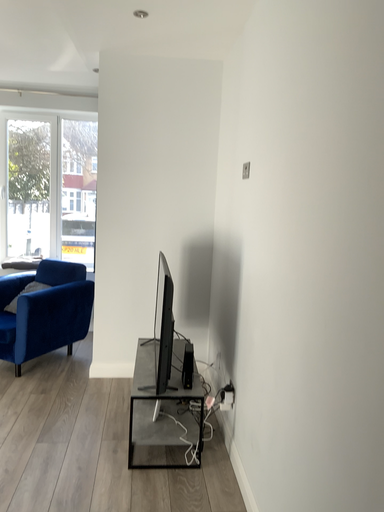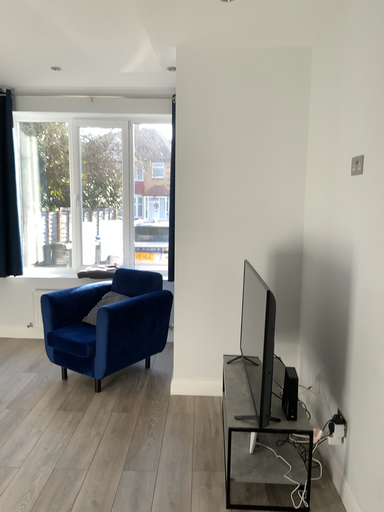
Question: How did the camera likely rotate when shooting the video?

Choices:
 (A) rotated left
 (B) rotated right

Answer: (A)